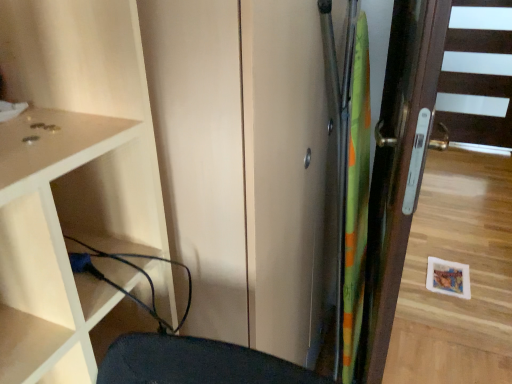
Question: From the image's perspective, would you say green fabric screen door at right is positioned over matte white cupboard at left?

Choices:
 (A) yes
 (B) no

Answer: (A)

Question: Is green fabric screen door at right shorter than matte white cupboard at left?

Choices:
 (A) no
 (B) yes

Answer: (A)

Question: Is green fabric screen door at right outside matte white cupboard at left?

Choices:
 (A) yes
 (B) no

Answer: (A)

Question: Can you confirm if green fabric screen door at right is smaller than matte white cupboard at left?

Choices:
 (A) yes
 (B) no

Answer: (B)

Question: Is green fabric screen door at right positioned with its back to matte white cupboard at left?

Choices:
 (A) no
 (B) yes

Answer: (A)

Question: From the image's perspective, is matte white cupboard at left above or below black rubber cable at lower left?

Choices:
 (A) above
 (B) below

Answer: (A)

Question: In the image, is matte white cupboard at left positioned in front of or behind black rubber cable at lower left?

Choices:
 (A) behind
 (B) front

Answer: (B)

Question: From a real-world perspective, is matte white cupboard at left positioned above or below black rubber cable at lower left?

Choices:
 (A) above
 (B) below

Answer: (A)

Question: Does point (18, 196) appear closer or farther from the camera than point (82, 264)?

Choices:
 (A) farther
 (B) closer

Answer: (B)

Question: Is matte white cupboard at left spatially inside brown wooden door at right, or outside of it?

Choices:
 (A) inside
 (B) outside

Answer: (B)

Question: From a real-world perspective, is matte white cupboard at left physically located above or below brown wooden door at right?

Choices:
 (A) below
 (B) above

Answer: (B)

Question: Based on their positions, is matte white cupboard at left located to the left or right of brown wooden door at right?

Choices:
 (A) right
 (B) left

Answer: (B)

Question: From the image's perspective, is matte white cupboard at left above or below brown wooden door at right?

Choices:
 (A) below
 (B) above

Answer: (A)

Question: Considering the positions of green fabric screen door at right and black rubber cable at lower left in the image, is green fabric screen door at right wider or thinner than black rubber cable at lower left?

Choices:
 (A) wide
 (B) thin

Answer: (A)

Question: In the image, is green fabric screen door at right positioned in front of or behind black rubber cable at lower left?

Choices:
 (A) behind
 (B) front

Answer: (B)